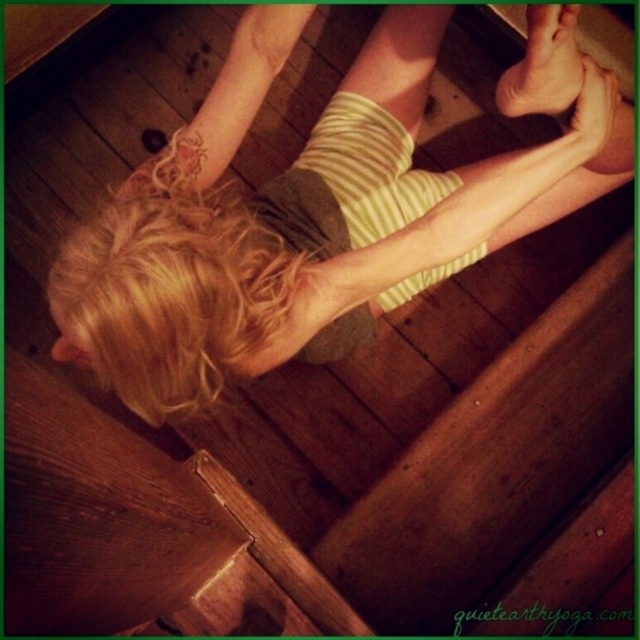
Can you confirm if blonde hair at upper center is wider than smooth skin foot at upper center?

Yes, blonde hair at upper center is wider than smooth skin foot at upper center.

Is blonde hair at upper center below smooth skin foot at upper center?

Correct, blonde hair at upper center is located below smooth skin foot at upper center.

Is point (58, 252) farther from camera compared to point (547, 44)?

Yes, it is behind point (547, 44).

You are a GUI agent. You are given a task and a screenshot of the screen. Output one action in this format:
    pyautogui.click(x=<x>, y=<y>)
    Task: Click on the blonde hair at upper center
    This screenshot has height=640, width=640.
    Given the screenshot: What is the action you would take?
    pyautogui.click(x=284, y=241)